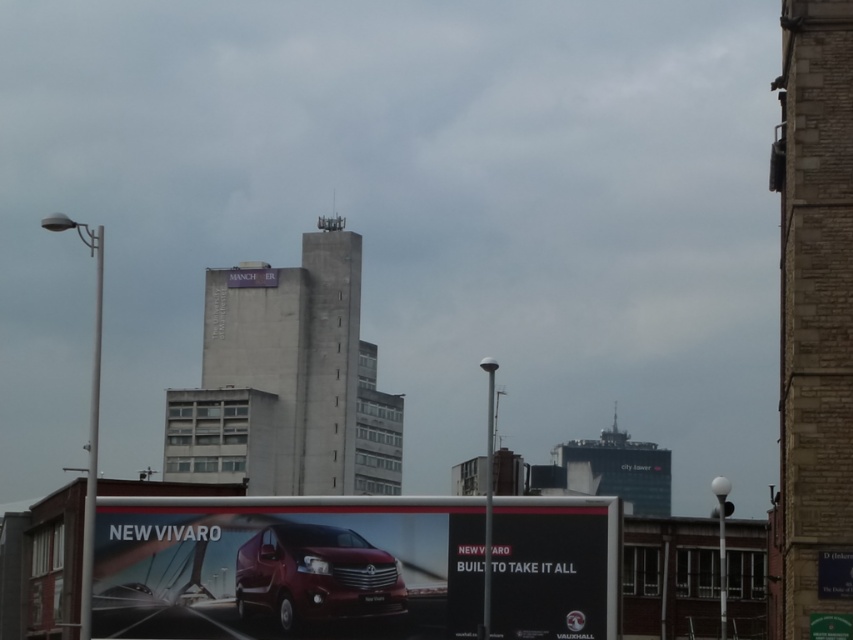
Does point (474, 627) come in front of point (260, 400)?

Yes, point (474, 627) is in front of point (260, 400).

Which is behind, point (383, 547) or point (315, 406)?

The point (315, 406) is more distant.

The image size is (853, 640). Find the location of `shiny red van at center`. shiny red van at center is located at coordinates (288, 566).

Can you confirm if brick textured building at right is shorter than concrete building at center?

Yes, brick textured building at right is shorter than concrete building at center.

Image resolution: width=853 pixels, height=640 pixels. Identify the location of brick textured building at right. point(815,316).

Between point (351, 461) and point (294, 570), which one is positioned behind?

The point (351, 461) is behind.

Can you confirm if concrete building at center is positioned to the left of glossy metallic van at center?

Correct, you'll find concrete building at center to the left of glossy metallic van at center.

The image size is (853, 640). What do you see at coordinates (287, 381) in the screenshot?
I see `concrete building at center` at bounding box center [287, 381].

Locate an element on the screen. concrete building at center is located at coordinates (287, 381).